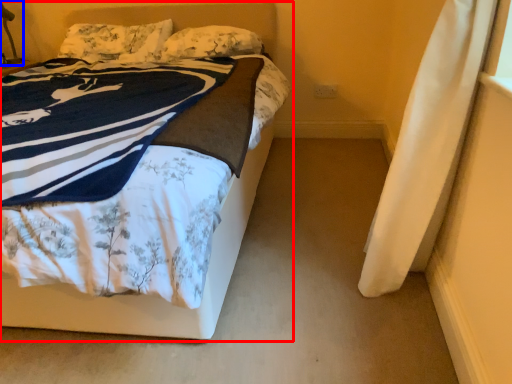
Question: Among these objects, which one is farthest to the camera, bed (highlighted by a red box) or table lamp (highlighted by a blue box)?

Choices:
 (A) bed
 (B) table lamp

Answer: (B)